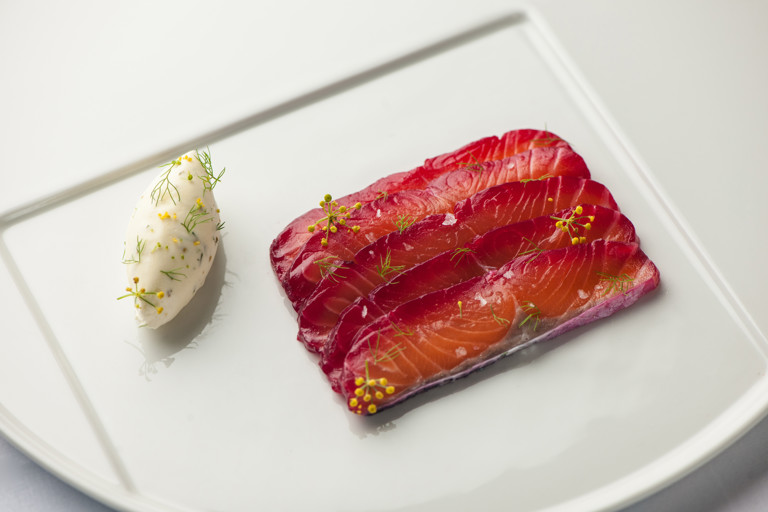
This screenshot has width=768, height=512. I want to click on shadow on countertop, so click(745, 476).